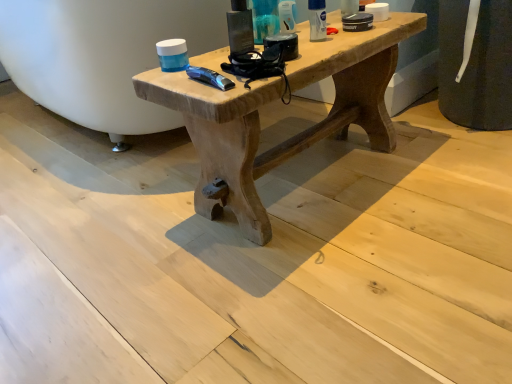
Find the location of `vacant space in natural wood table at center (from a real-world perspective)`. vacant space in natural wood table at center (from a real-world perspective) is located at coordinates (306, 177).